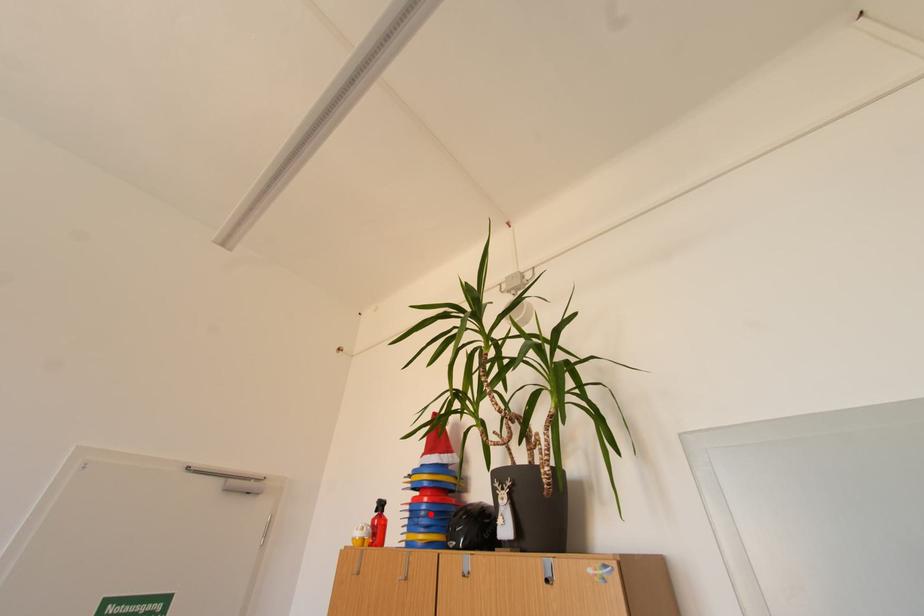
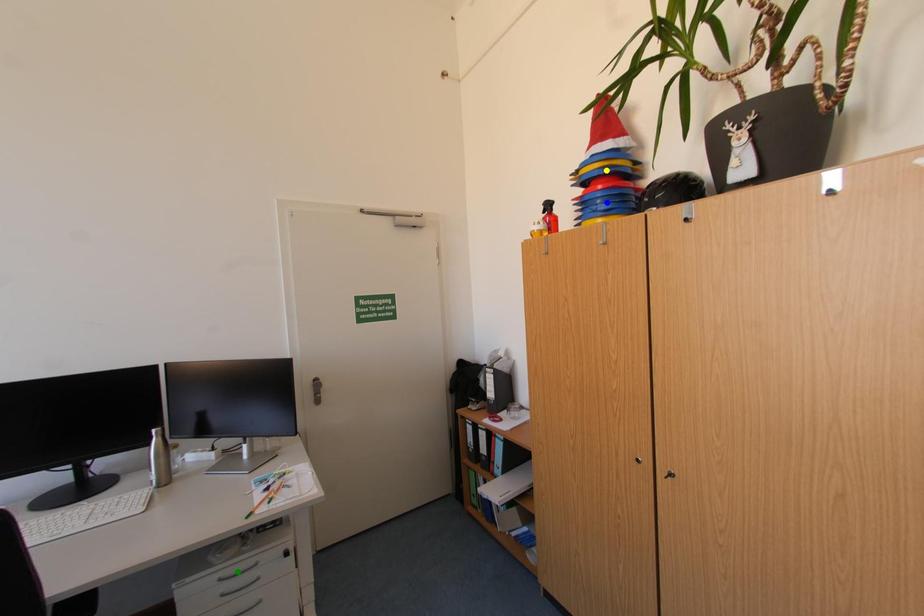
Question: I am providing you with two images of the same scene from different viewpoints. A red point is marked on the first image. You are given multiple points on the second image. Which point in image 2 is actually the same real-world point as the red point in image 1?

Choices:
 (A) yellow point
 (B) green point
 (C) blue point

Answer: (C)